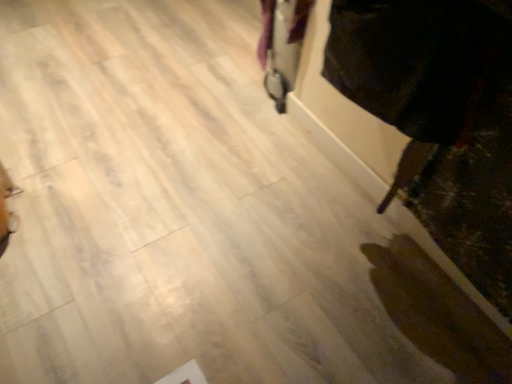
You are a GUI agent. You are given a task and a screenshot of the screen. Output one action in this format:
    pyautogui.click(x=<x>, y=<y>)
    Task: Click on the dark velvet robe at right
    The image size is (512, 384).
    Given the screenshot: What is the action you would take?
    pyautogui.click(x=421, y=62)

What do you see at coordinates (421, 62) in the screenshot? This screenshot has width=512, height=384. I see `dark velvet robe at right` at bounding box center [421, 62].

This screenshot has width=512, height=384. In order to click on dark velvet robe at right in this screenshot , I will do `click(421, 62)`.